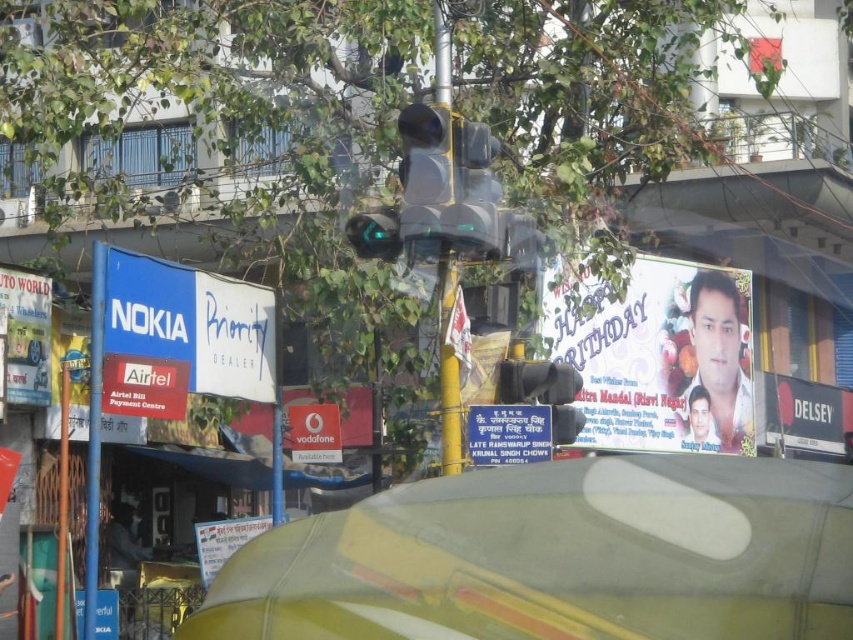
Which of these two, camouflage fabric car at center or yellow metallic pole at center, stands shorter?

camouflage fabric car at center

Is camouflage fabric car at center to the right of yellow metallic pole at center from the viewer's perspective?

Correct, you'll find camouflage fabric car at center to the right of yellow metallic pole at center.

Is point (390, 600) less distant than point (436, 72)?

Yes.

In order to click on camouflage fabric car at center in this screenshot , I will do `click(556, 556)`.

At what (x,y) coordinates should I click in order to perform the action: click on camouflage fabric car at center. Please return your answer as a coordinate pair (x, y). This screenshot has height=640, width=853. Looking at the image, I should click on (556, 556).

Can you confirm if camouflage fabric car at center is smaller than blue plastic nokia priority dealer sign at upper left?

No, camouflage fabric car at center is not smaller than blue plastic nokia priority dealer sign at upper left.

Between point (309, 588) and point (225, 328), which one is positioned in front?

Point (309, 588)

At what (x,y) coordinates should I click in order to perform the action: click on camouflage fabric car at center. Please return your answer as a coordinate pair (x, y). Image resolution: width=853 pixels, height=640 pixels. Looking at the image, I should click on (556, 556).

Who is taller, yellow matte traffic light at center or red glossy signboard at center?

yellow matte traffic light at center is taller.

Which is behind, point (469, 147) or point (357, 416)?

The point (357, 416) is more distant.

Who is more distant from viewer, (440, 198) or (252, 410)?

Positioned behind is point (252, 410).

The image size is (853, 640). Identify the location of yellow matte traffic light at center. (448, 182).